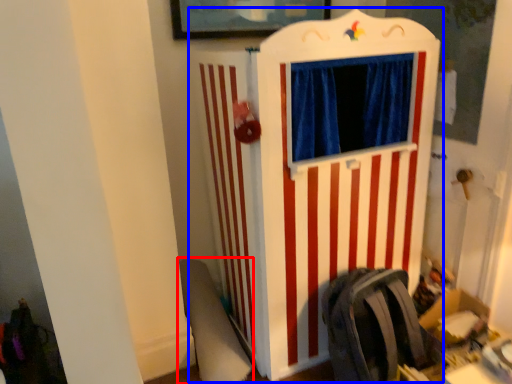
Question: Which object is further to the camera taking this photo, swivel chair (highlighted by a red box) or furniture (highlighted by a blue box)?

Choices:
 (A) swivel chair
 (B) furniture

Answer: (A)